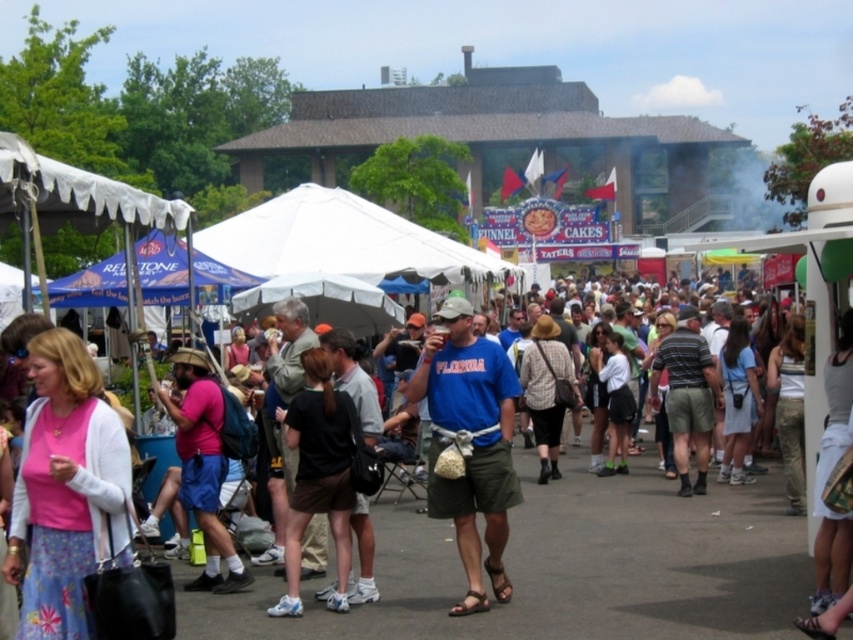
Who is shorter, pink fabric blouse at center or blue cotton shirt at center?

blue cotton shirt at center

Is point (90, 497) farther from viewer compared to point (508, 378)?

No, (90, 497) is closer to viewer.

This screenshot has height=640, width=853. What are the coordinates of `pink fabric blouse at center` in the screenshot? It's located at (67, 490).

Does point (434, 324) come behind point (199, 400)?

Yes.

Based on the photo, who is more distant from viewer, (436, 448) or (207, 538)?

The point (207, 538) is more distant.

I want to click on blue cotton shirt at center, so click(469, 444).

Can you confirm if black fabric shirt at center is shorter than pink fabric shirt at center?

In fact, black fabric shirt at center may be taller than pink fabric shirt at center.

Does black fabric shirt at center have a greater height compared to pink fabric shirt at center?

Indeed, black fabric shirt at center has a greater height compared to pink fabric shirt at center.

I want to click on black fabric shirt at center, so click(x=318, y=476).